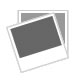
Identify the location of frame. This screenshot has width=80, height=80. (47, 56).